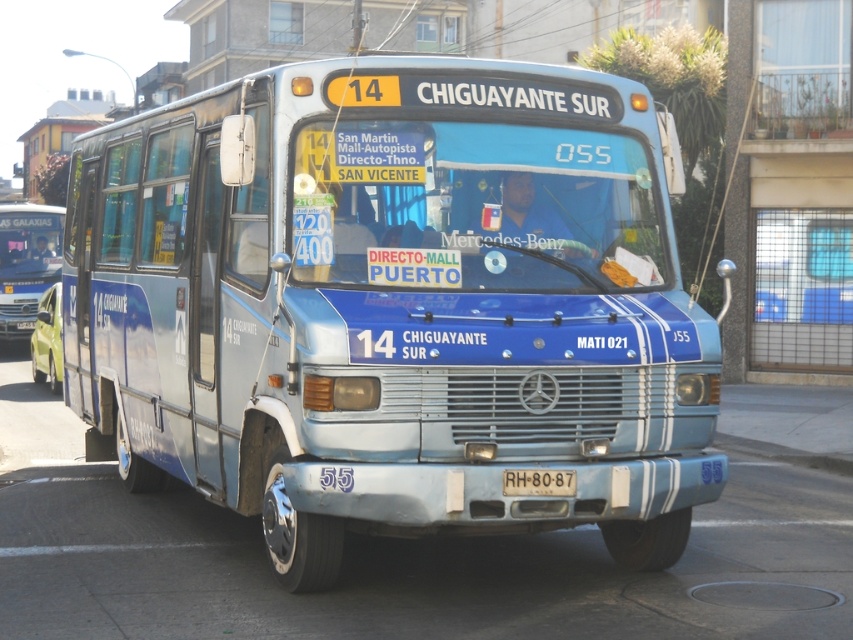
Is blue metallic bus at center further to camera compared to white plastic license plate at center?

No.

Does blue metallic bus at center have a greater width compared to white plastic license plate at center?

Correct, the width of blue metallic bus at center exceeds that of white plastic license plate at center.

The height and width of the screenshot is (640, 853). I want to click on blue metallic bus at center, so click(392, 305).

The image size is (853, 640). What do you see at coordinates (392, 305) in the screenshot?
I see `blue metallic bus at center` at bounding box center [392, 305].

Who is positioned more to the left, blue metallic bus at center or matte blue bus at left?

From the viewer's perspective, matte blue bus at left appears more on the left side.

Where is `blue metallic bus at center`? blue metallic bus at center is located at coordinates (392, 305).

From the picture: Which is above, matte blue bus at left or white plastic license plate at center?

matte blue bus at left is higher up.

Which is below, matte blue bus at left or white plastic license plate at center?

Positioned lower is white plastic license plate at center.

Which is behind, point (28, 269) or point (566, 493)?

The point (28, 269) is more distant.

This screenshot has height=640, width=853. What are the coordinates of `matte blue bus at left` in the screenshot? It's located at (26, 262).